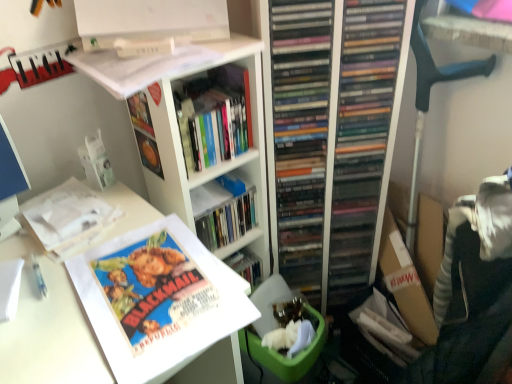
Question: Can you confirm if black plastic computer chair at right is wider than hardcover book at center, the first book from the top?

Choices:
 (A) no
 (B) yes

Answer: (A)

Question: Does black plastic computer chair at right have a greater height compared to hardcover book at center, placed as the third book when sorted from bottom to top?

Choices:
 (A) yes
 (B) no

Answer: (A)

Question: Is black plastic computer chair at right to the right of hardcover book at center, the first book from the top, from the viewer's perspective?

Choices:
 (A) no
 (B) yes

Answer: (B)

Question: Does black plastic computer chair at right have a larger size compared to hardcover book at center, placed as the third book when sorted from bottom to top?

Choices:
 (A) no
 (B) yes

Answer: (B)

Question: Is hardcover book at center, placed as the third book when sorted from bottom to top, inside black plastic computer chair at right?

Choices:
 (A) no
 (B) yes

Answer: (A)

Question: Is hardcover book at center, the first book from the top, to the left or to the right of white matte bookshelf at upper center in the image?

Choices:
 (A) left
 (B) right

Answer: (B)

Question: From the image's perspective, is hardcover book at center, placed as the third book when sorted from bottom to top, above or below white matte bookshelf at upper center?

Choices:
 (A) below
 (B) above

Answer: (B)

Question: From a real-world perspective, is hardcover book at center, placed as the third book when sorted from bottom to top, positioned above or below white matte bookshelf at upper center?

Choices:
 (A) below
 (B) above

Answer: (B)

Question: Is point (197, 91) closer or farther from the camera than point (176, 115)?

Choices:
 (A) closer
 (B) farther

Answer: (B)

Question: In the image, is matte paper poster at lower left, which appears as the third book when viewed from the top, positioned in front of or behind white paper at upper left, which appears as the 2th book when ordered from the bottom?

Choices:
 (A) front
 (B) behind

Answer: (A)

Question: From the image's perspective, is matte paper poster at lower left, which appears as the third book when viewed from the top, positioned above or below white paper at upper left, which appears as the 2th book when ordered from the bottom?

Choices:
 (A) below
 (B) above

Answer: (A)

Question: Is matte paper poster at lower left, placed as the 1th book when sorted from bottom to top, situated inside white paper at upper left, which appears as the 2th book when ordered from the bottom, or outside?

Choices:
 (A) outside
 (B) inside

Answer: (A)

Question: Looking at their shapes, would you say matte paper poster at lower left, placed as the 1th book when sorted from bottom to top, is wider or thinner than white paper at upper left, which appears as the 2th book when ordered from the bottom?

Choices:
 (A) wide
 (B) thin

Answer: (A)

Question: From a real-world perspective, relative to white paper at upper left, which appears as the 2th book when ordered from the bottom, is white matte bookshelf at upper center vertically above or below?

Choices:
 (A) below
 (B) above

Answer: (A)

Question: Based on their sizes in the image, would you say white matte bookshelf at upper center is bigger or smaller than white paper at upper left, which appears as the 2th book when ordered from the bottom?

Choices:
 (A) big
 (B) small

Answer: (A)